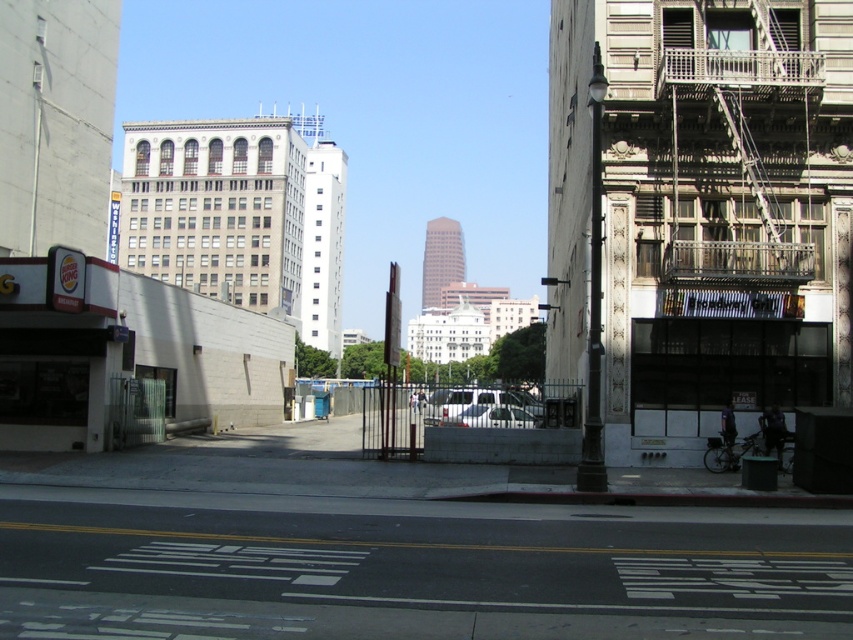
Question: Does metallic silver fire escape at right appear over silver metallic van at center?

Choices:
 (A) yes
 (B) no

Answer: (A)

Question: Which of these objects is positioned closest to the silver metallic van at center?

Choices:
 (A) silver metallic car at center
 (B) metallic silver fire escape at right

Answer: (A)

Question: Is metallic silver fire escape at right to the left of silver metallic car at center from the viewer's perspective?

Choices:
 (A) no
 (B) yes

Answer: (A)

Question: Does metallic silver fire escape at right appear on the right side of silver metallic van at center?

Choices:
 (A) no
 (B) yes

Answer: (B)

Question: Considering the real-world distances, which object is farthest from the silver metallic car at center?

Choices:
 (A) silver metallic van at center
 (B) metallic silver fire escape at right

Answer: (B)

Question: Which point is farther to the camera?

Choices:
 (A) (747, 51)
 (B) (430, 406)

Answer: (B)